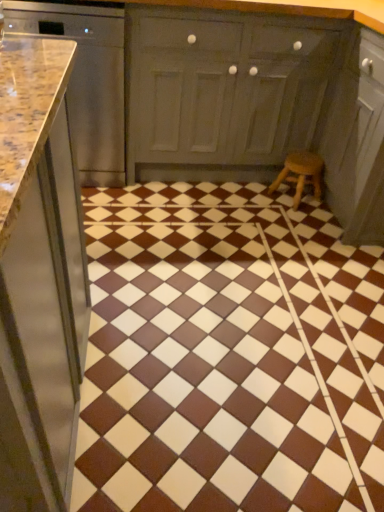
I want to click on vacant space in between wooden stool at lower right and matte gray cabinet at center, marked as the first cabinetry in a right-to-left arrangement, so click(244, 194).